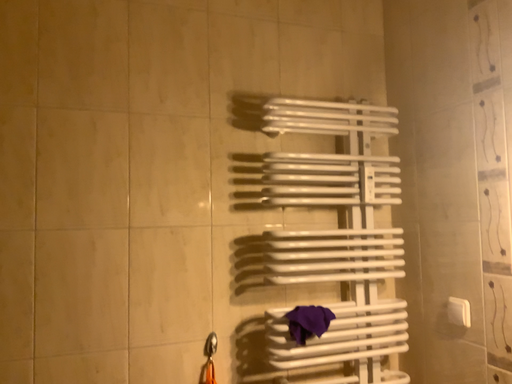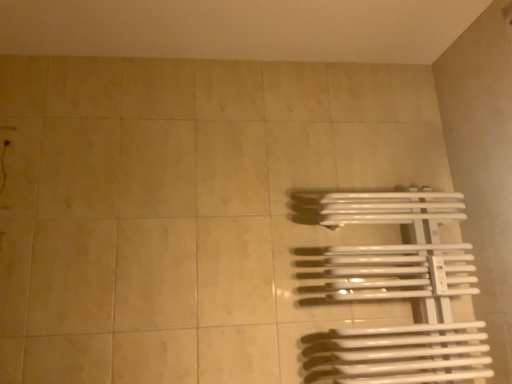
Question: Which way did the camera rotate in the video?

Choices:
 (A) rotated left
 (B) rotated right

Answer: (A)